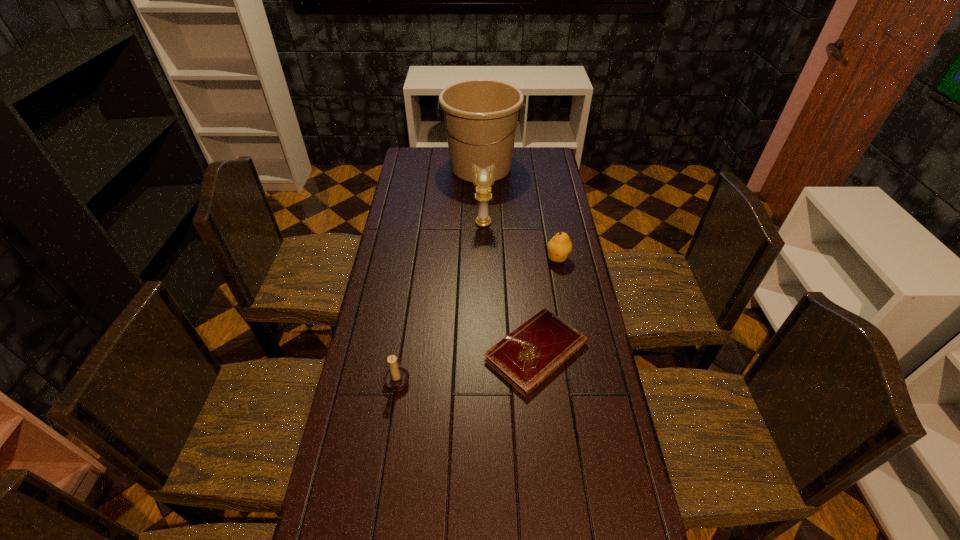
Identify the location of vacant space at the far right corner. (557, 170).

Locate an element on the screen. The image size is (960, 540). vacant space that's between the leftmost object and the farthest object is located at coordinates (440, 273).

Find the location of a particular element. This screenshot has width=960, height=540. free space that is in between the leftmost object and the award is located at coordinates (441, 301).

At what (x,y) coordinates should I click in order to perform the action: click on free point between the second tallest object and the notebook. Please return your answer as a coordinate pair (x, y). The width and height of the screenshot is (960, 540). Looking at the image, I should click on (510, 287).

Find the location of `vacant area that lies between the pear and the notebook`. vacant area that lies between the pear and the notebook is located at coordinates (547, 305).

Where is `vacant space in between the notebook and the bucket`? Image resolution: width=960 pixels, height=540 pixels. vacant space in between the notebook and the bucket is located at coordinates (509, 259).

Image resolution: width=960 pixels, height=540 pixels. Find the location of `vacant region between the farthest object and the notebook`. vacant region between the farthest object and the notebook is located at coordinates (509, 259).

In order to click on object that stands as the third closest to the award in this screenshot , I will do `click(528, 355)`.

You are a GUI agent. You are given a task and a screenshot of the screen. Output one action in this format:
    pyautogui.click(x=<x>, y=<y>)
    Task: Click on the object that is the fourth nearest to the bucket
    The width and height of the screenshot is (960, 540).
    Given the screenshot: What is the action you would take?
    [x=396, y=378]

Locate an element on the screen. The image size is (960, 540). vacant area in the image that satisfies the following two spatial constraints: 1. on the front side of the farthest object; 2. on the left side of the notebook is located at coordinates (481, 352).